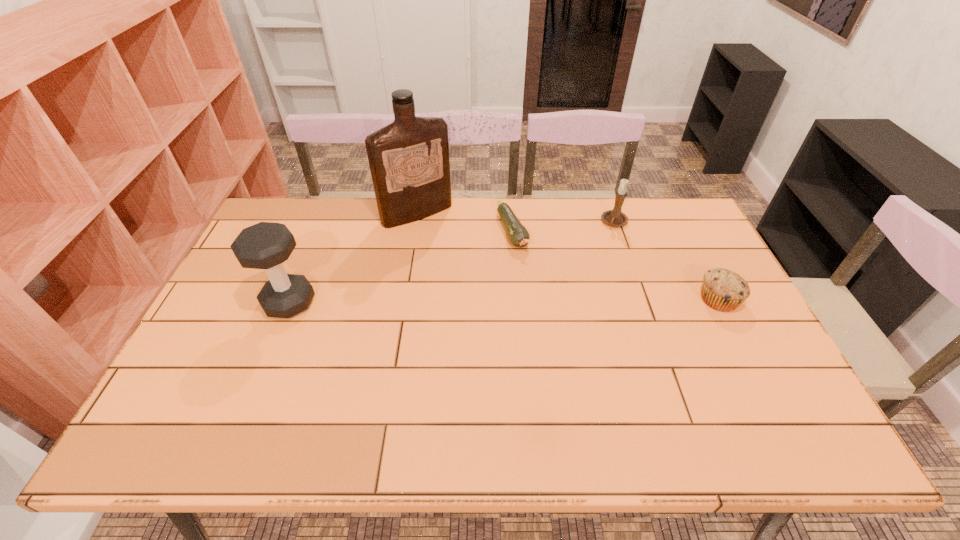
Locate an element on the screen. blank space at the near left corner of the desktop is located at coordinates (227, 382).

Image resolution: width=960 pixels, height=540 pixels. In order to click on vacant area between the zucchini and the second shortest object in this screenshot , I will do `click(615, 266)`.

At what (x,y) coordinates should I click in order to perform the action: click on free point between the rightmost object and the liquor. Please return your answer as a coordinate pair (x, y). This screenshot has width=960, height=540. Looking at the image, I should click on tap(568, 256).

Locate an element on the screen. free space between the zucchini and the fourth shortest object is located at coordinates (401, 267).

Locate an element on the screen. vacant space that is in between the dumbbell and the second object from left to right is located at coordinates (353, 258).

I want to click on vacant space that's between the shortest object and the second tallest object, so click(x=401, y=267).

Locate an element on the screen. empty location between the candle holder and the dumbbell is located at coordinates (452, 262).

The height and width of the screenshot is (540, 960). In order to click on vacant region between the second object from right to left and the leftmost object in this screenshot , I will do `click(452, 262)`.

The width and height of the screenshot is (960, 540). I want to click on vacant space that is in between the dumbbell and the muffin, so click(504, 301).

This screenshot has width=960, height=540. What are the coordinates of `empty space that is in between the leftmost object and the liquor` in the screenshot? It's located at (353, 258).